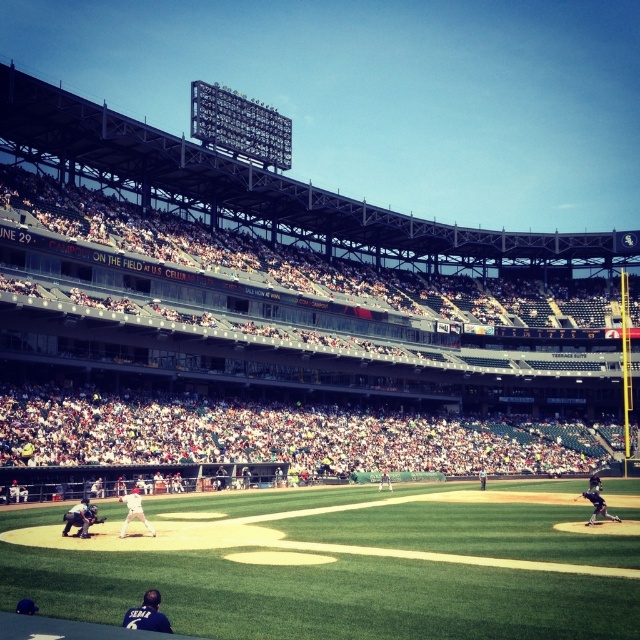
You are a player standing at home plate and need to quickly grab the brown leather glove at center. However, there is an obstruction blocking your path. Which direction should you move to avoid the white uniformed umpire at center?

The white uniformed umpire at center is to the right of the brown leather glove at center, so you should move to the left to avoid the umpire and reach the glove.

You are a spectator sitting in the stands of the baseball stadium. You notice the green grass baseball field at center and the black uniform at center. Which object is positioned more to the left from your viewpoint?

The green grass baseball field at center is to the left of the black uniform at center, so the green grass baseball field at center is positioned more to the left from your viewpoint.

You are standing at the camera position capturing the baseball game. There is a point marked at coordinates point (275, 506). Can you reach that point without moving the camera?

The point (275, 506) is 255.99 feet away from the camera, so you cannot reach it without moving the camera since it is too far.